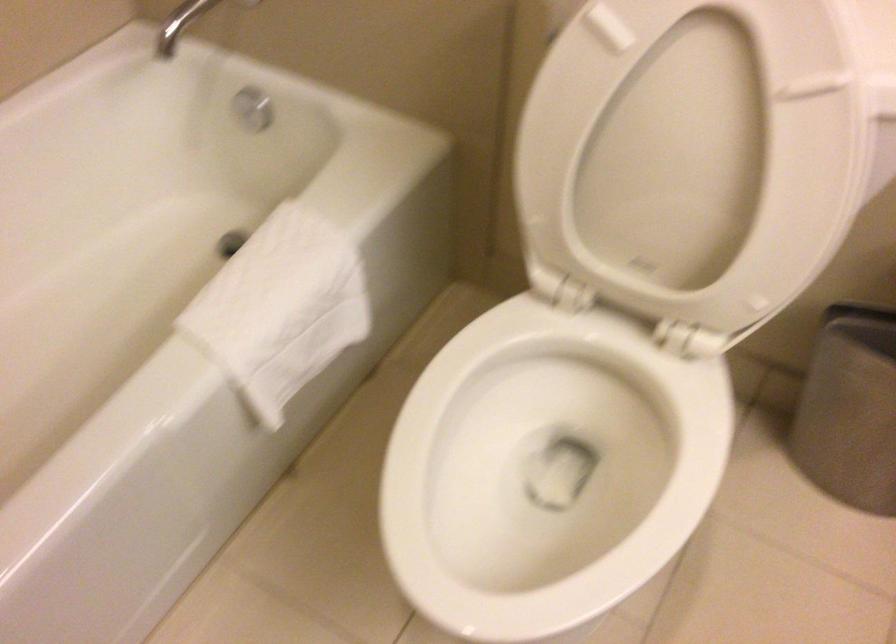
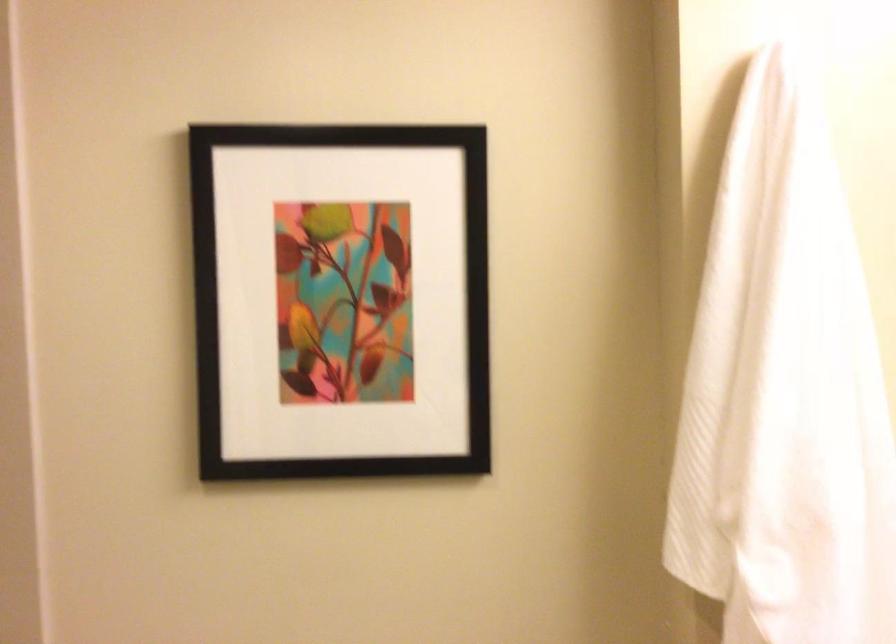
First-person continuous shooting, in which direction is the camera rotating?

The rotation direction of the camera is right-up.